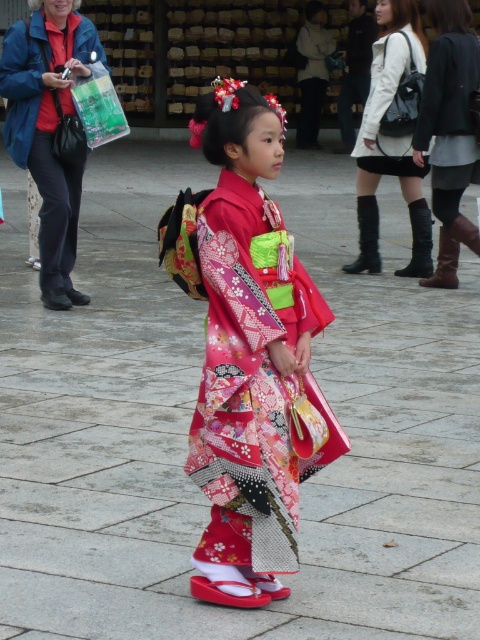
Question: Is leather boots at right wider than white leather dress at upper center?

Choices:
 (A) no
 (B) yes

Answer: (A)

Question: Which point is farther to the camera?

Choices:
 (A) (456, 68)
 (B) (262, 262)

Answer: (A)

Question: Which of the following is the farthest from the observer?

Choices:
 (A) leather boots at right
 (B) matte blue jacket at upper left
 (C) white leather jacket at upper center
 (D) silky kimono at center

Answer: (C)

Question: Does silky kimono at center appear over matte blue jacket at upper left?

Choices:
 (A) no
 (B) yes

Answer: (A)

Question: Which of the following is the closest to the observer?

Choices:
 (A) click(x=71, y=97)
 (B) click(x=383, y=54)
 (C) click(x=233, y=508)
 (D) click(x=420, y=74)

Answer: (C)

Question: Is silky kimono at center to the left of white leather jacket at upper center from the viewer's perspective?

Choices:
 (A) no
 (B) yes

Answer: (B)